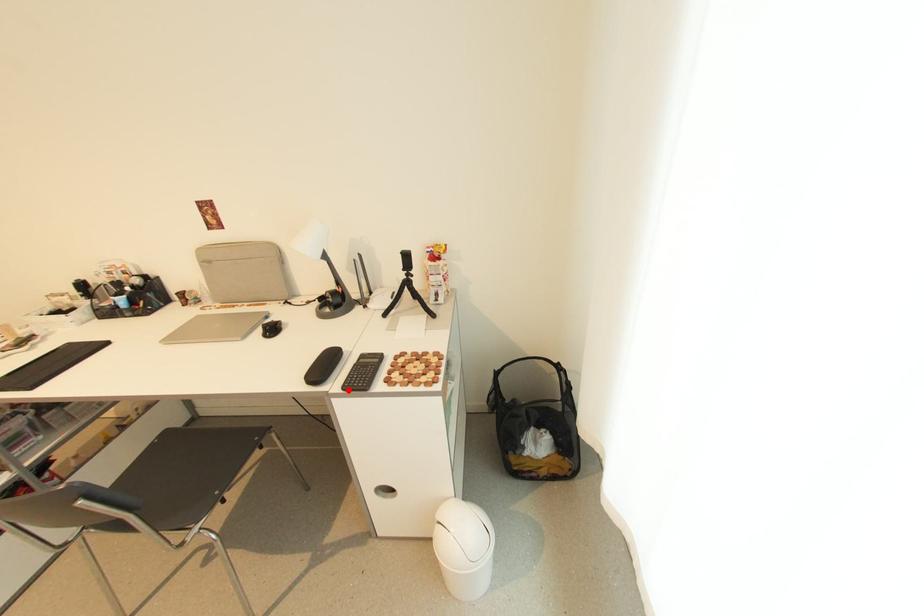
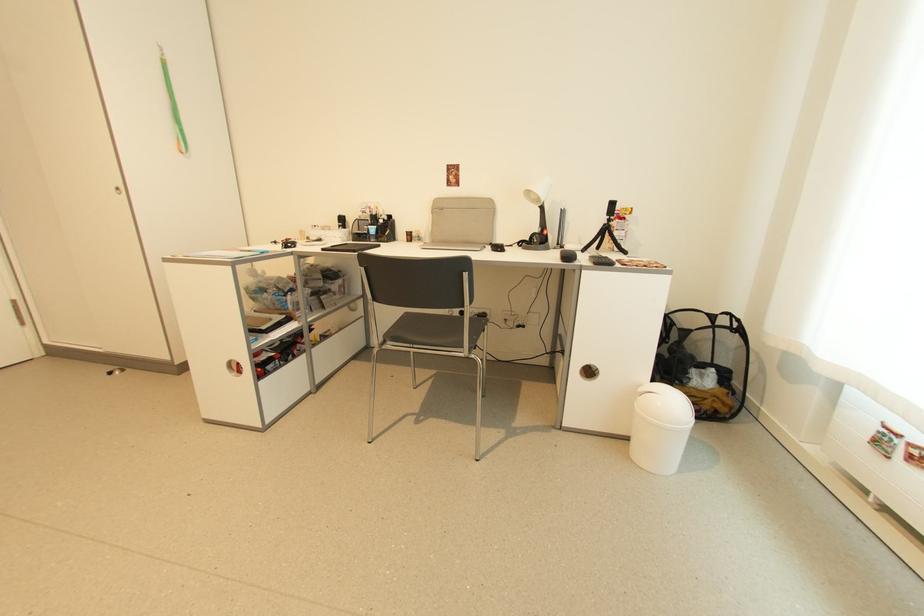
In the second image, find the point that corresponds to the highlighted location in the first image.

(600, 265)